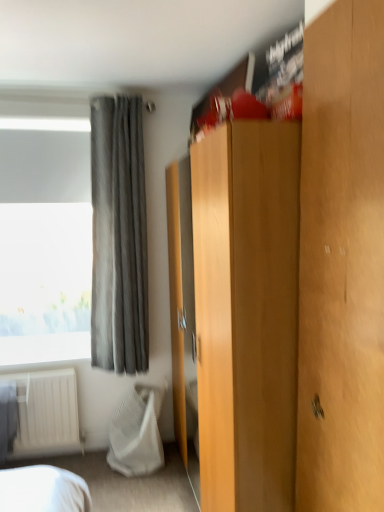
Question: Which is correct: white textured blanket at lower left is inside gray fabric curtain at upper left, or outside of it?

Choices:
 (A) outside
 (B) inside

Answer: (A)

Question: From the image's perspective, relative to gray fabric curtain at upper left, is white textured blanket at lower left above or below?

Choices:
 (A) above
 (B) below

Answer: (B)

Question: Based on their relative distances, which object is farther from the light brown wood dresser at center?

Choices:
 (A) gray fabric curtain at upper left
 (B) wooden door at right
 (C) white textured blanket at lower left

Answer: (C)

Question: Which object is the farthest from the gray fabric curtain at upper left?

Choices:
 (A) wooden door at right
 (B) light brown wood dresser at center
 (C) white textured blanket at lower left

Answer: (A)